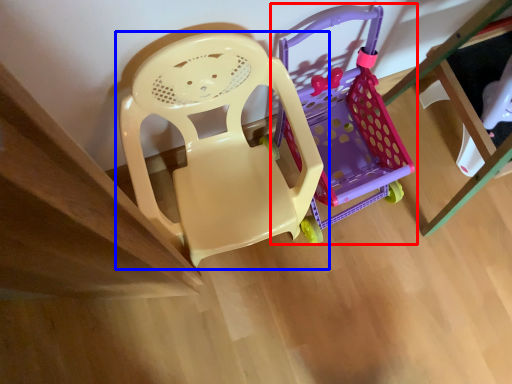
Question: Which object appears farthest to the camera in this image, toy (highlighted by a red box) or chair (highlighted by a blue box)?

Choices:
 (A) toy
 (B) chair

Answer: (A)